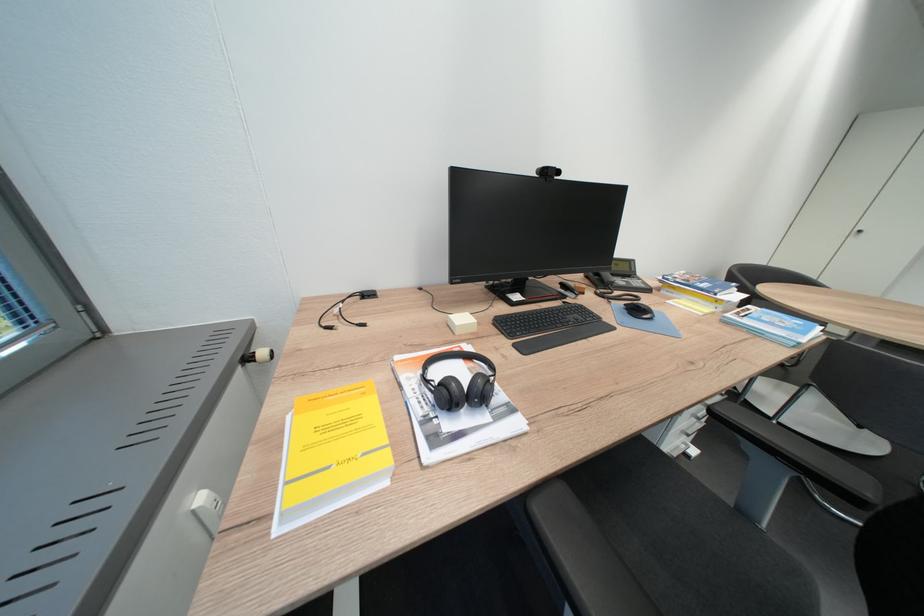
Image resolution: width=924 pixels, height=616 pixels. In order to click on black headphones in this screenshot , I will do `click(458, 382)`.